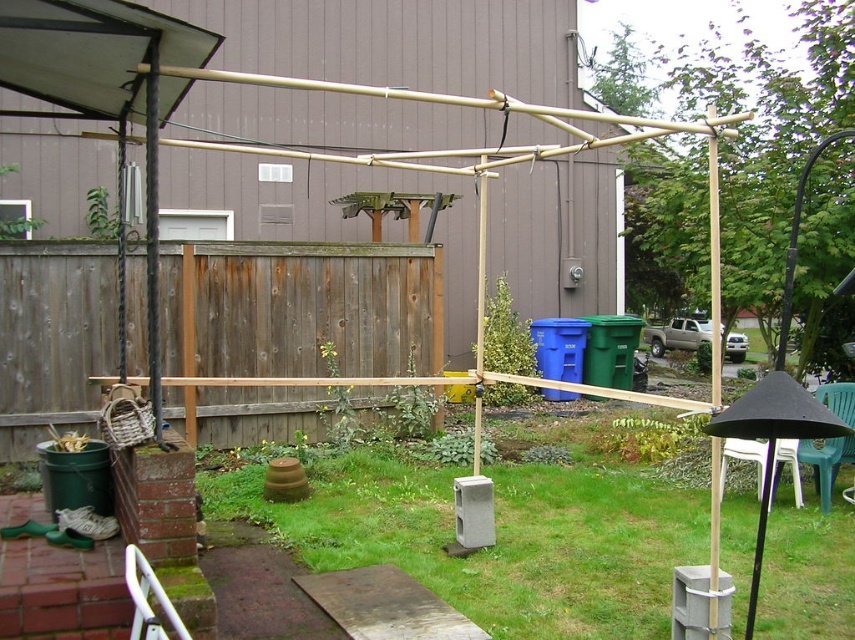
Looking at this image, you are planning to install a new bench in your backyard. You want to place it where it won not block the view of the wooden fence at center from the green plastic chair at lower right. Based on their heights, which object should be placed higher to ensure the view remains unobstructed?

The wooden fence at center is taller than the green plastic chair at lower right. To keep the view of the wooden fence at center unobstructed from the green plastic chair at lower right, the bench should be placed lower than the green plastic chair at lower right so it doesn

In the scene shown: You are standing in the backyard and want to place a small potted plant between the two points marked as point (417, 358) and point (848, 394). Which point should the plant be closer to in order to be positioned closer to the camera?

The plant should be closer to point (417, 358) because it is further to the camera than point (848, 394).

You are standing in the backyard and want to place a small potted plant on the ground. The wooden fence at center is in your way. Can you move the white plastic chair at lower right to make space?

The wooden fence at center is positioned over the white plastic chair at lower right, meaning the chair is underneath the fence. To create space for the potted plant, you can move the white plastic chair at lower right from under the wooden fence at center.